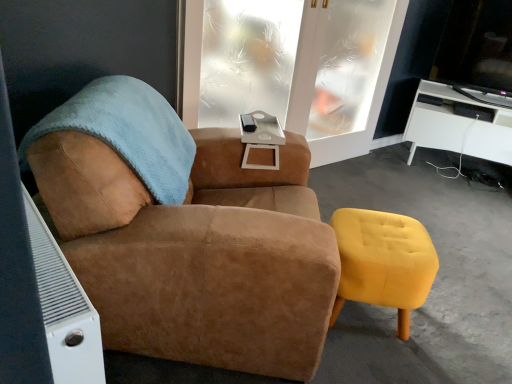
You are a GUI agent. You are given a task and a screenshot of the screen. Output one action in this format:
    pyautogui.click(x=<x>, y=<y>)
    Task: Click on the vacant region above yellow velvet stool at lower right (from a real-world perspective)
    This screenshot has width=512, height=384.
    Given the screenshot: What is the action you would take?
    click(x=384, y=235)